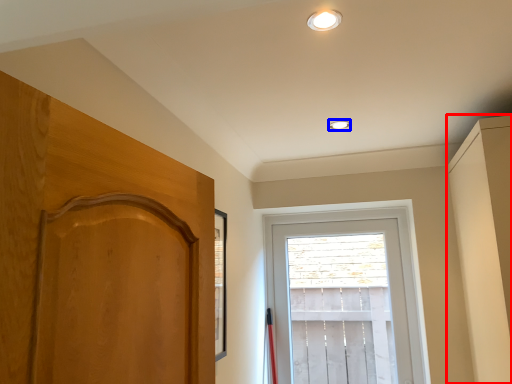
Question: Which object appears farthest to the camera in this image, dresser (highlighted by a red box) or lighting (highlighted by a blue box)?

Choices:
 (A) dresser
 (B) lighting

Answer: (B)